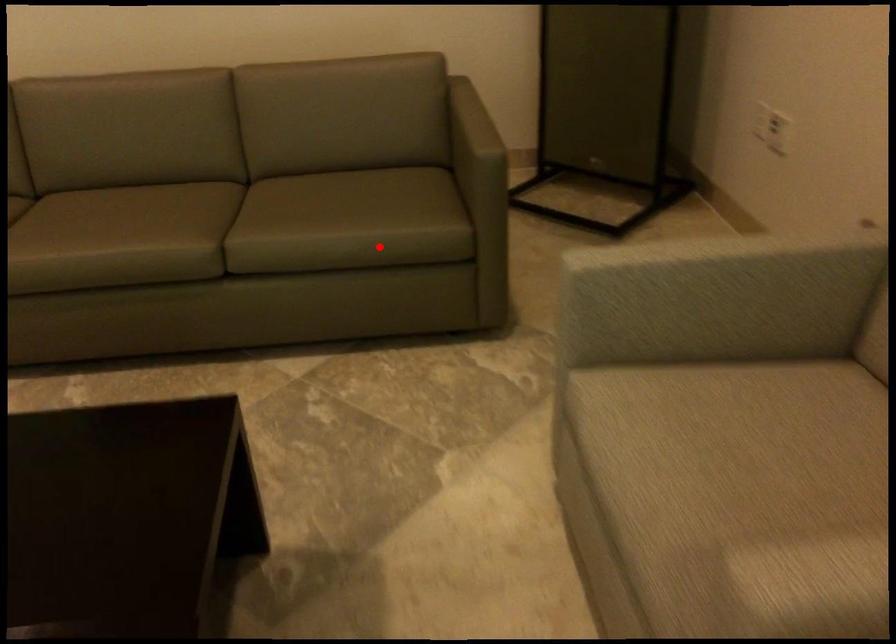
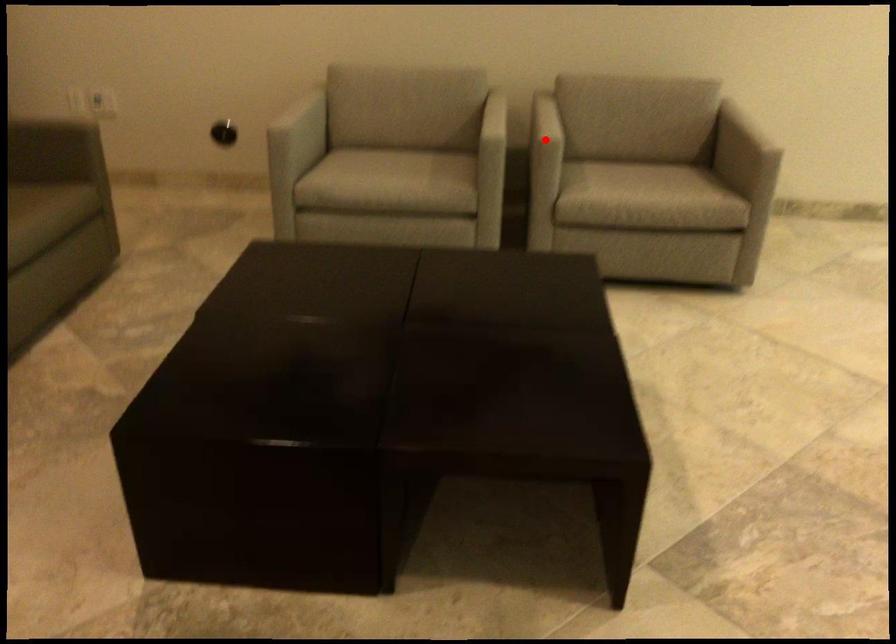
I am providing you with two images of the same scene from different viewpoints. A red point is marked on the first image and another point is marked on the second image. Does the point marked in image1 correspond to the same location as the one in image2?

No